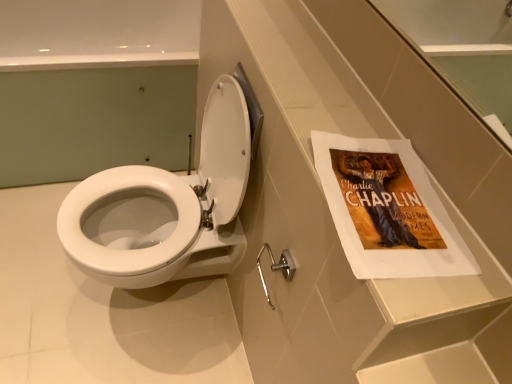
Question: Could you tell me if silver metallic towel bar at lower center is facing white glossy toilet at center?

Choices:
 (A) yes
 (B) no

Answer: (B)

Question: Is silver metallic towel bar at lower center at the right side of white glossy toilet at center?

Choices:
 (A) no
 (B) yes

Answer: (B)

Question: Can you confirm if silver metallic towel bar at lower center is taller than white glossy toilet at center?

Choices:
 (A) no
 (B) yes

Answer: (A)

Question: From a real-world perspective, is silver metallic towel bar at lower center located higher than white glossy toilet at center?

Choices:
 (A) no
 (B) yes

Answer: (B)

Question: From the image's perspective, is silver metallic towel bar at lower center beneath white glossy toilet at center?

Choices:
 (A) yes
 (B) no

Answer: (A)

Question: Is silver metallic towel bar at lower center closer to the viewer compared to white glossy toilet at center?

Choices:
 (A) no
 (B) yes

Answer: (A)

Question: Is silver metallic towel bar at lower center further to the viewer compared to white glossy toilet at center?

Choices:
 (A) yes
 (B) no

Answer: (B)

Question: Considering the relative sizes of silver metallic towel bar at lower center and white glossy toilet at center in the image provided, is silver metallic towel bar at lower center smaller than white glossy toilet at center?

Choices:
 (A) no
 (B) yes

Answer: (B)

Question: From the image's perspective, is silver metallic towel bar at lower center located above white glossy toilet at center?

Choices:
 (A) no
 (B) yes

Answer: (A)

Question: Is there a large distance between silver metallic towel bar at lower center and white glossy toilet at center?

Choices:
 (A) no
 (B) yes

Answer: (A)

Question: Considering the relative sizes of silver metallic towel bar at lower center and white glossy toilet at center in the image provided, is silver metallic towel bar at lower center thinner than white glossy toilet at center?

Choices:
 (A) no
 (B) yes

Answer: (B)

Question: Considering the relative sizes of silver metallic towel bar at lower center and white glossy toilet at center in the image provided, is silver metallic towel bar at lower center taller than white glossy toilet at center?

Choices:
 (A) yes
 (B) no

Answer: (B)

Question: Considering the relative sizes of white glossy toilet at center and white glossy toilet at center in the image provided, is white glossy toilet at center shorter than white glossy toilet at center?

Choices:
 (A) no
 (B) yes

Answer: (B)